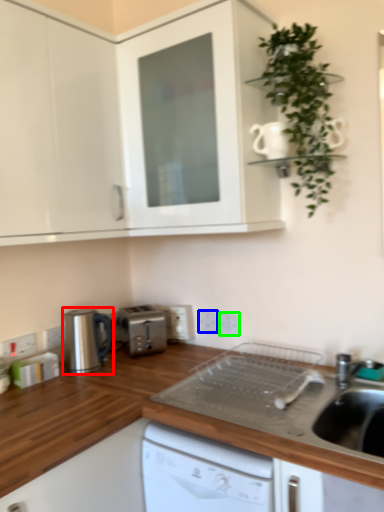
Question: Based on their relative distances, which object is farther from home appliance (highlighted by a red box)? Choose from electric outlet (highlighted by a blue box) and electric outlet (highlighted by a green box).

Choices:
 (A) electric outlet
 (B) electric outlet

Answer: (B)